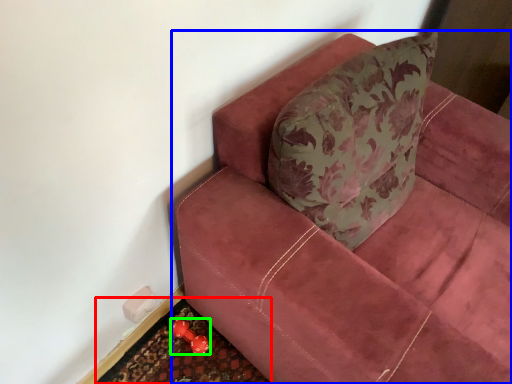
Question: Estimate the real-world distances between objects in this image. Which object is farther from doormat (highlighted by a red box), studio couch (highlighted by a blue box) or toy (highlighted by a green box)?

Choices:
 (A) studio couch
 (B) toy

Answer: (A)